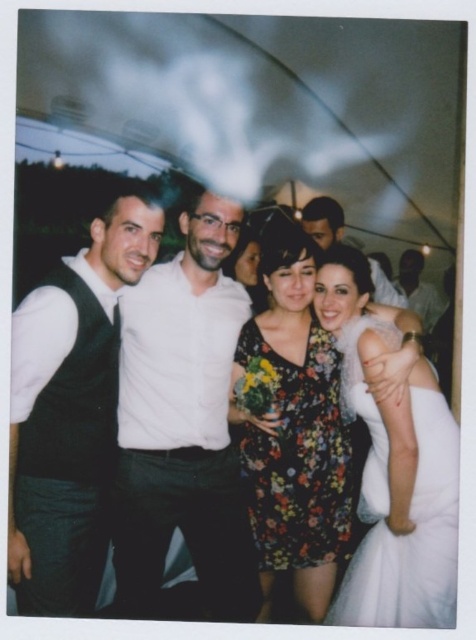
You are a photographer trying to adjust the lighting for the group photo. You notice the matte black vest at left and the floral print fabric dress at center. Which object is covering part of the other in the image?

The matte black vest at left is positioned over the floral print fabric dress at center, so it is covering part of it.

You are a photographer at the event and want to ensure that both the white matte shirt at center and the floral print fabric dress at center are visible in the photo. Given their height difference, which one might you need to adjust the camera angle for to include both properly?

The white matte shirt at center is much taller than the floral print fabric dress at center, so you should lower the camera angle slightly to ensure both are fully visible in the photo.